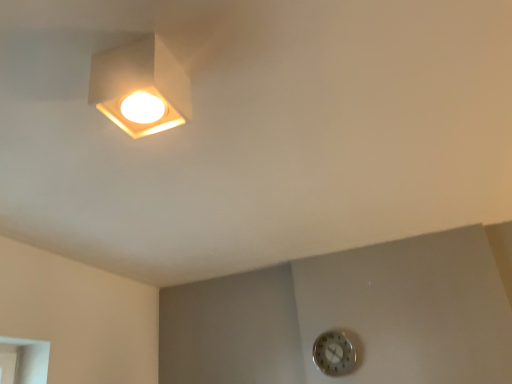
Question: From a real-world perspective, relative to metallic silver clock at lower right, is matte white square lamp at upper left vertically above or below?

Choices:
 (A) below
 (B) above

Answer: (B)

Question: Do you think matte white square lamp at upper left is within metallic silver clock at lower right, or outside of it?

Choices:
 (A) outside
 (B) inside

Answer: (A)

Question: Is matte white square lamp at upper left bigger or smaller than metallic silver clock at lower right?

Choices:
 (A) small
 (B) big

Answer: (B)

Question: From the image's perspective, is metallic silver clock at lower right positioned above or below matte white square lamp at upper left?

Choices:
 (A) below
 (B) above

Answer: (A)

Question: From a real-world perspective, is metallic silver clock at lower right above or below matte white square lamp at upper left?

Choices:
 (A) below
 (B) above

Answer: (A)

Question: Is metallic silver clock at lower right inside the boundaries of matte white square lamp at upper left, or outside?

Choices:
 (A) outside
 (B) inside

Answer: (A)

Question: Based on their sizes in the image, would you say metallic silver clock at lower right is bigger or smaller than matte white square lamp at upper left?

Choices:
 (A) small
 (B) big

Answer: (A)